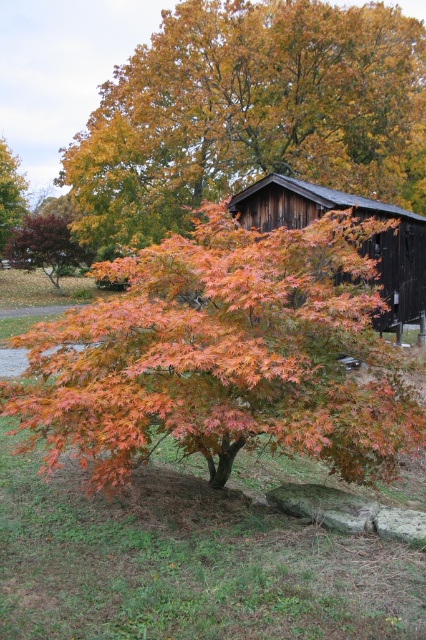
Question: Is orange glossy leaves at center below smooth reddish-brown tree at upper left?

Choices:
 (A) no
 (B) yes

Answer: (B)

Question: Which object is farther from the camera taking this photo?

Choices:
 (A) smooth reddish-brown tree at upper left
 (B) orange matte tree at center

Answer: (A)

Question: Does orange matte tree at center have a larger size compared to dark brown wooden barn at center?

Choices:
 (A) no
 (B) yes

Answer: (B)

Question: Which of the following is the farthest from the observer?

Choices:
 (A) (31, 260)
 (B) (267, 212)
 (C) (345, 173)

Answer: (A)

Question: Which of the following is the farthest from the observer?

Choices:
 (A) orange matte tree at center
 (B) orange glossy leaves at center
 (C) smooth reddish-brown tree at upper left

Answer: (C)

Question: Is the position of orange matte tree at center less distant than that of dark brown wooden barn at center?

Choices:
 (A) no
 (B) yes

Answer: (A)